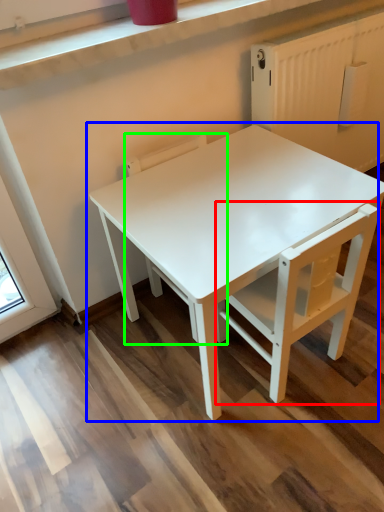
Question: Which object is the closest to the chair (highlighted by a red box)? Choose among these: table (highlighted by a blue box) or chair (highlighted by a green box).

Choices:
 (A) table
 (B) chair

Answer: (A)